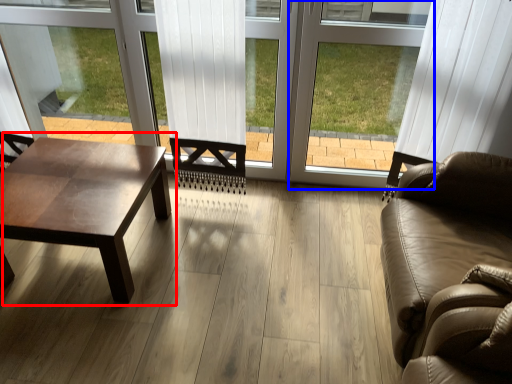
Question: Which object appears farthest to the camera in this image, coffee table (highlighted by a red box) or window frame (highlighted by a blue box)?

Choices:
 (A) coffee table
 (B) window frame

Answer: (B)